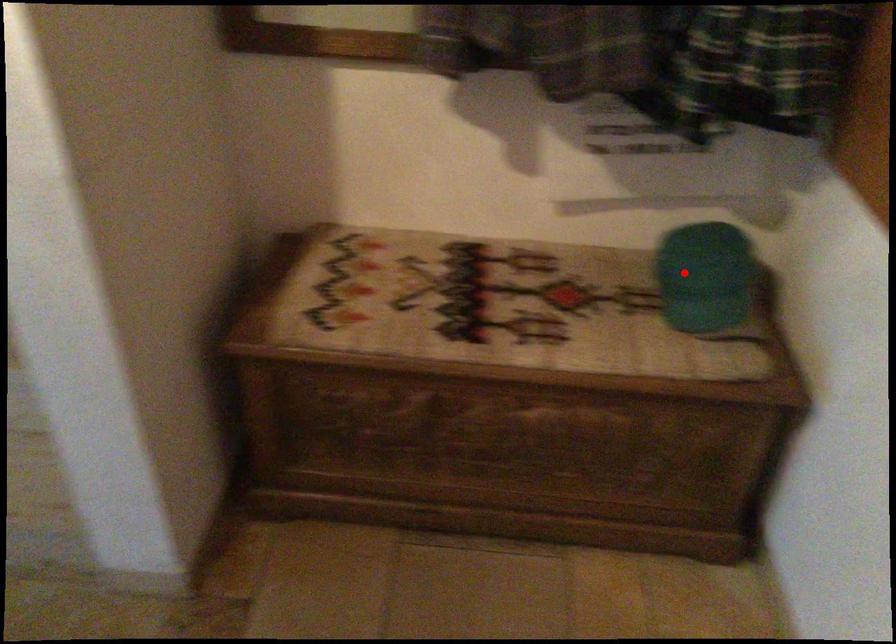
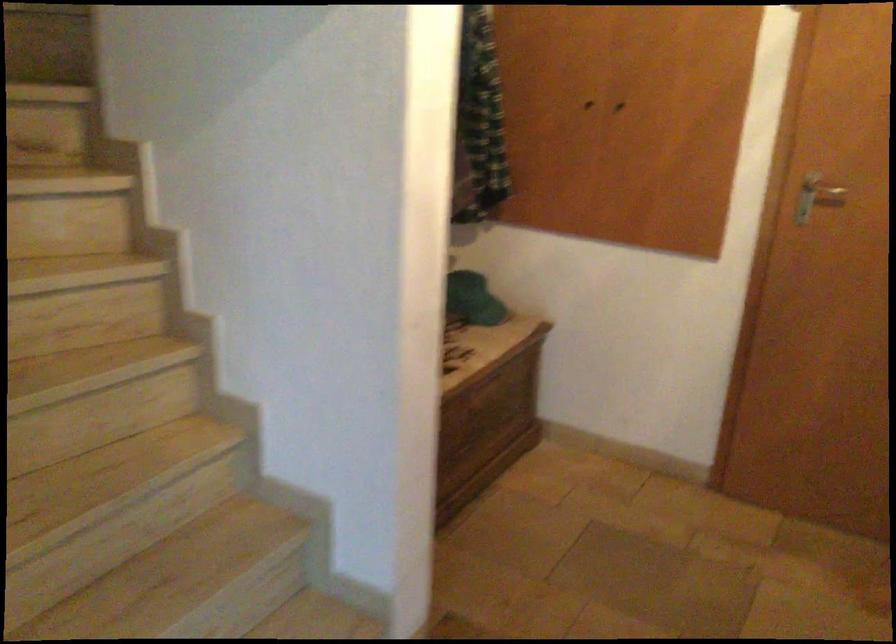
Question: I am providing you with two images of the same scene from different viewpoints. In image1, a red point is highlighted. Considering the same 3D point in image2, which of the following is correct?

Choices:
 (A) It is closer
 (B) It is farther

Answer: (B)